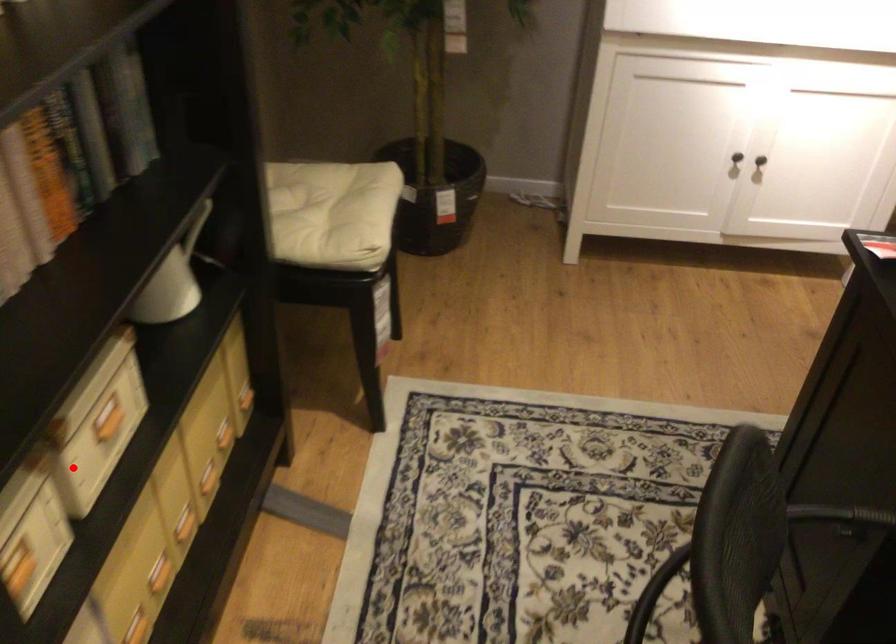
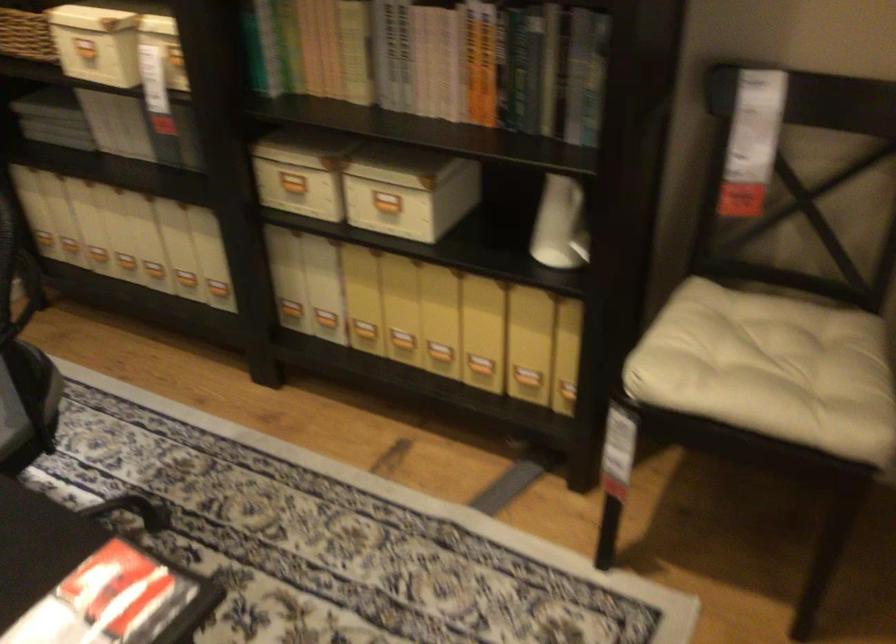
Question: I am providing you with two images of the same scene from different viewpoints. In image1, a red point is highlighted. Considering the same 3D point in image2, which of the following is correct?

Choices:
 (A) It is closer
 (B) It is farther

Answer: (B)